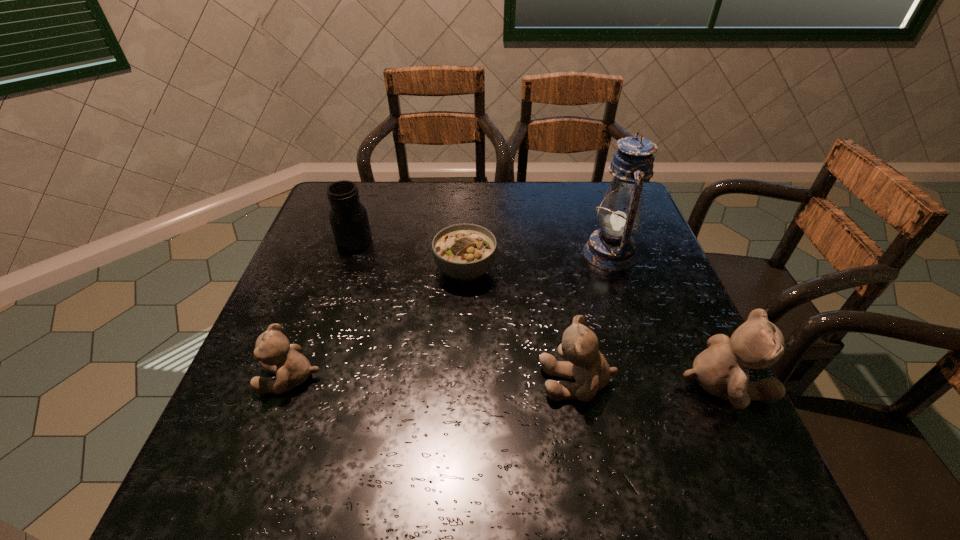
At what (x,y) coordinates should I click in order to perform the action: click on the shortest teddy bear. Please return your answer as a coordinate pair (x, y). Looking at the image, I should click on (275, 354).

Find the location of a particular element. The image size is (960, 540). the second shortest object is located at coordinates (275, 354).

Locate an element on the screen. The height and width of the screenshot is (540, 960). the second teddy bear from right to left is located at coordinates (585, 364).

Identify the location of the second tallest teddy bear. (585, 364).

In order to click on the rightmost teddy bear in this screenshot , I will do `click(722, 370)`.

Locate an element on the screen. The image size is (960, 540). the fourth object from right to left is located at coordinates (462, 251).

The width and height of the screenshot is (960, 540). In order to click on soup bowl in this screenshot , I will do point(462,251).

Identify the location of lantern. (612, 248).

This screenshot has height=540, width=960. I want to click on jar, so click(x=348, y=217).

You are a GUI agent. You are given a task and a screenshot of the screen. Output one action in this format:
    pyautogui.click(x=<x>, y=<y>)
    Task: Click on the vacant space located 0.080m on the face of the second teddy bear from left to right
    The image size is (960, 540).
    Given the screenshot: What is the action you would take?
    pyautogui.click(x=499, y=381)